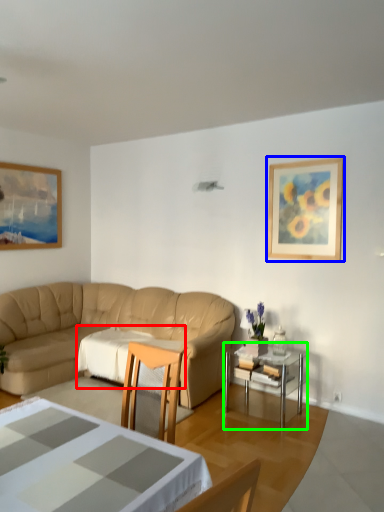
Question: Which object is positioned closest to tablecloth (highlighted by a red box)? Select from picture frame (highlighted by a blue box) and table (highlighted by a green box).

Choices:
 (A) picture frame
 (B) table

Answer: (B)